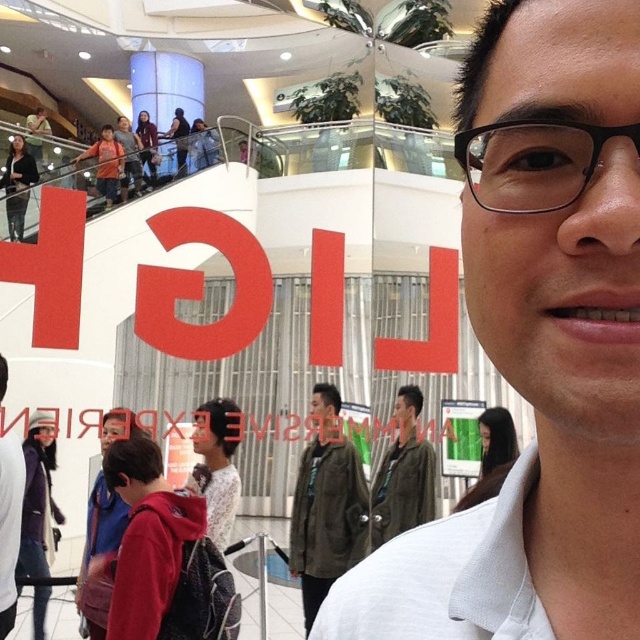
Question: Which of the following is the closest to the observer?

Choices:
 (A) (378, 467)
 (B) (513, 205)
 (C) (356, 618)
 (D) (88, 586)

Answer: (B)

Question: Is black plastic glasses at upper right smaller than green textured jacket at center?

Choices:
 (A) no
 (B) yes

Answer: (B)

Question: Which of the following is the closest to the observer?

Choices:
 (A) (570, 164)
 (B) (570, 163)
 (C) (108, 589)
 (D) (406, 442)

Answer: (A)

Question: Does white matte shirt at center lie in front of green textured jacket at center?

Choices:
 (A) yes
 (B) no

Answer: (A)

Question: Which object is positioned farthest from the black plastic glasses at upper right?

Choices:
 (A) green textured jacket at center
 (B) red hoodie at lower left

Answer: (A)

Question: Does black plastic glasses at upper right appear on the left side of green textured jacket at center?

Choices:
 (A) no
 (B) yes

Answer: (B)